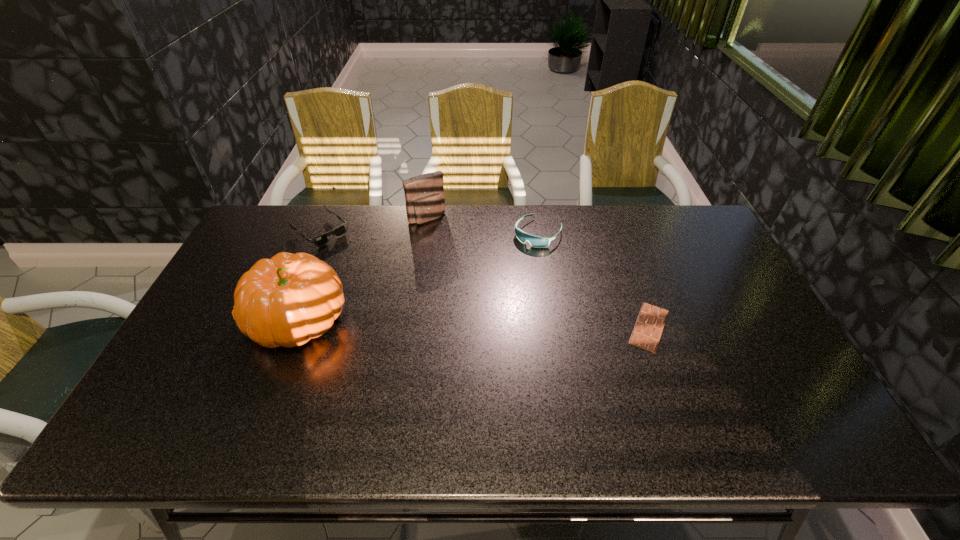
In order to click on free region located 0.100m with an open flap on the third object from left to right in this screenshot , I will do `click(447, 241)`.

Image resolution: width=960 pixels, height=540 pixels. In order to click on goggles situated at the far edge in this screenshot , I will do `click(535, 241)`.

What are the coordinates of `sunglasses present at the far edge` in the screenshot? It's located at (339, 231).

Identify the location of pouch present at the far edge. (424, 194).

Identify the location of pumpkin that is positioned at the left edge. (287, 300).

This screenshot has height=540, width=960. I want to click on sunglasses located at the left edge, so (339, 231).

In order to click on object present at the far left corner in this screenshot , I will do `click(339, 231)`.

Image resolution: width=960 pixels, height=540 pixels. Find the location of `vacant region at the far edge`. vacant region at the far edge is located at coordinates (300, 230).

This screenshot has height=540, width=960. In order to click on blank space at the left edge of the desktop in this screenshot , I will do `click(247, 253)`.

In the image, there is a desktop. Identify the location of vacant space at the right edge. This screenshot has height=540, width=960. (716, 300).